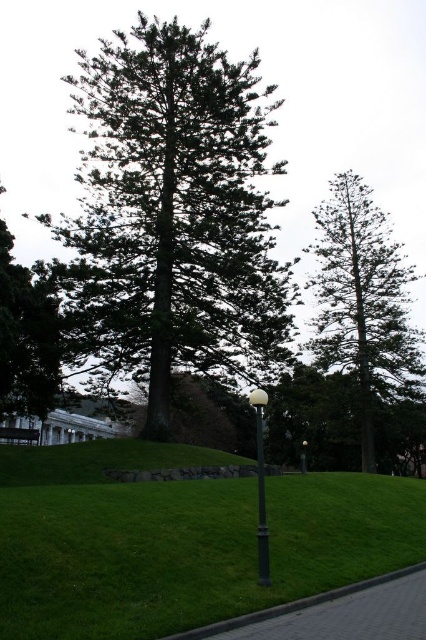
Question: Which of the following is the closest to the observer?

Choices:
 (A) (377, 268)
 (B) (17, 442)
 (C) (5, 308)

Answer: (C)

Question: Which object appears closest to the camera in this image?

Choices:
 (A) green needle-like tree at center
 (B) brick pavement at lower center
 (C) matte black lamp post at center
 (D) wooden park bench at lower left

Answer: (B)

Question: Is brick pavement at lower center wider than wooden park bench at lower left?

Choices:
 (A) no
 (B) yes

Answer: (A)

Question: Estimate the real-world distances between objects in this image. Which object is farther from the matte black lamp post at center?

Choices:
 (A) brick pavement at lower center
 (B) green grass at center
 (C) wooden park bench at lower left
 (D) green needle-like tree at center

Answer: (C)

Question: Considering the relative positions of green grass at center and brick pavement at lower center in the image provided, where is green grass at center located with respect to brick pavement at lower center?

Choices:
 (A) left
 (B) right

Answer: (A)

Question: Can you confirm if green grass at center is positioned to the right of green needle-like tree at center?

Choices:
 (A) no
 (B) yes

Answer: (A)